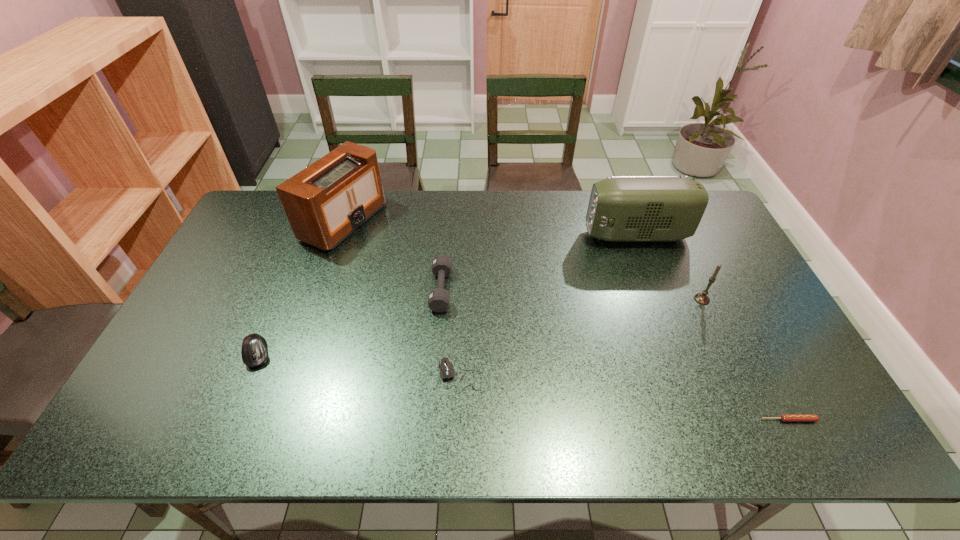
The image size is (960, 540). In order to click on blank space located 0.070m on the front of the left radio_receiver in this screenshot , I will do `click(327, 269)`.

Identify the location of vacant area situated on the front-facing side of the right radio_receiver. This screenshot has width=960, height=540. (571, 235).

Find the location of `vacant area situated 0.390m on the front-facing side of the right radio_receiver`. vacant area situated 0.390m on the front-facing side of the right radio_receiver is located at coordinates (468, 235).

At what (x,y) coordinates should I click in order to perform the action: click on free spot located on the front-facing side of the right radio_receiver. Please return your answer as a coordinate pair (x, y). The height and width of the screenshot is (540, 960). Looking at the image, I should click on (532, 235).

Locate an element on the screen. The image size is (960, 540). free region located on the left of the candle is located at coordinates (555, 299).

This screenshot has width=960, height=540. I want to click on vacant area situated 0.310m on the left of the fourth tallest object, so click(x=325, y=289).

Locate an element on the screen. This screenshot has height=540, width=960. vacant position located on the left of the taller computer mouse is located at coordinates (172, 354).

Where is `free space located on the right of the shorter computer mouse`? The height and width of the screenshot is (540, 960). free space located on the right of the shorter computer mouse is located at coordinates (643, 376).

Identify the location of free space located on the left of the shortest object. (652, 420).

Where is `object located at the near edge`? This screenshot has height=540, width=960. object located at the near edge is located at coordinates (784, 417).